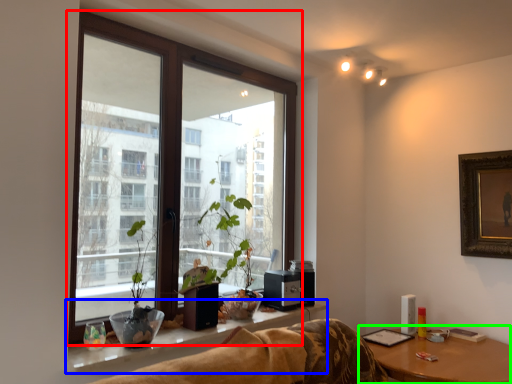
Question: Considering the real-world distances, which object is farthest from window (highlighted by a red box)? window sill (highlighted by a blue box) or table (highlighted by a green box)?

Choices:
 (A) window sill
 (B) table

Answer: (B)